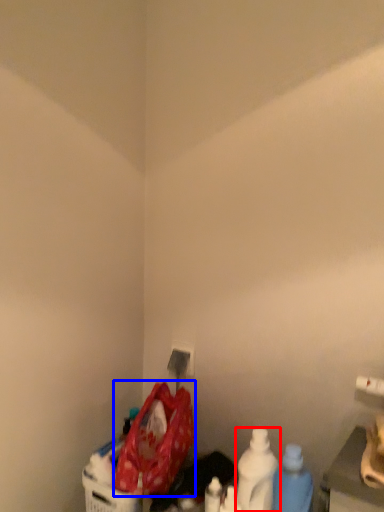
Question: Among these objects, which one is nearest to the camera, bottle (highlighted by a red box) or waste (highlighted by a blue box)?

Choices:
 (A) bottle
 (B) waste

Answer: (B)